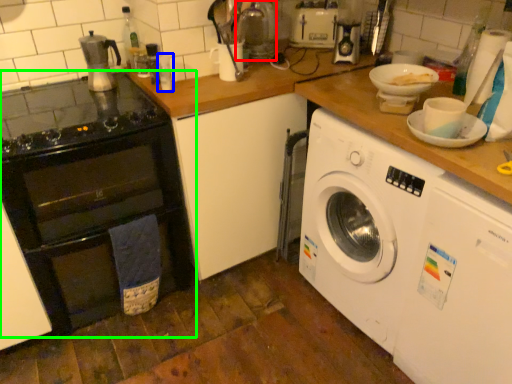
Question: Which is farther away from appliance (highlighted by a red box)? bottle (highlighted by a blue box) or oven (highlighted by a green box)?

Choices:
 (A) bottle
 (B) oven

Answer: (B)